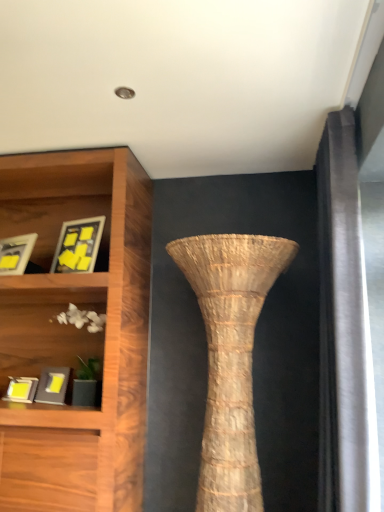
Question: Is the depth of natural woven vase at center greater than that of matte yellow picture frame at left, positioned as the 2th picture frame in top-to-bottom order?

Choices:
 (A) yes
 (B) no

Answer: (B)

Question: Is natural woven vase at center at the right side of matte yellow picture frame at left, which is the 3th picture frame from bottom to top?

Choices:
 (A) yes
 (B) no

Answer: (A)

Question: Does natural woven vase at center lie in front of matte yellow picture frame at left, which is the 3th picture frame from bottom to top?

Choices:
 (A) yes
 (B) no

Answer: (A)

Question: Can you confirm if natural woven vase at center is wider than matte yellow picture frame at left, which is the 3th picture frame from bottom to top?

Choices:
 (A) no
 (B) yes

Answer: (B)

Question: Is natural woven vase at center directly adjacent to matte yellow picture frame at left, which is the 3th picture frame from bottom to top?

Choices:
 (A) no
 (B) yes

Answer: (A)

Question: Considering their positions, is matte black picture frame at lower left, the 4th picture frame when ordered from top to bottom, located in front of or behind matte yellow picture frame at left, which is the 3th picture frame from bottom to top?

Choices:
 (A) front
 (B) behind

Answer: (B)

Question: Is matte black picture frame at lower left, the 1th picture frame from the bottom, inside the boundaries of matte yellow picture frame at left, which is the 3th picture frame from bottom to top, or outside?

Choices:
 (A) outside
 (B) inside

Answer: (A)

Question: Is matte black picture frame at lower left, the 4th picture frame when ordered from top to bottom, taller or shorter than matte yellow picture frame at left, which is the 3th picture frame from bottom to top?

Choices:
 (A) short
 (B) tall

Answer: (A)

Question: Based on their sizes in the image, would you say matte black picture frame at lower left, the 4th picture frame when ordered from top to bottom, is bigger or smaller than matte yellow picture frame at left, which is the 3th picture frame from bottom to top?

Choices:
 (A) big
 (B) small

Answer: (B)

Question: Considering the relative positions of white matte shells at lower left and matte black picture frame at lower left, the 4th picture frame when ordered from top to bottom, in the image provided, is white matte shells at lower left to the left or to the right of matte black picture frame at lower left, the 4th picture frame when ordered from top to bottom,?

Choices:
 (A) left
 (B) right

Answer: (B)

Question: Is point (3, 329) closer or farther from the camera than point (21, 392)?

Choices:
 (A) closer
 (B) farther

Answer: (B)

Question: From a real-world perspective, is white matte shells at lower left above or below matte black picture frame at lower left, the 1th picture frame from the bottom?

Choices:
 (A) above
 (B) below

Answer: (A)

Question: Considering the positions of white matte shells at lower left and matte black picture frame at lower left, the 4th picture frame when ordered from top to bottom, in the image, is white matte shells at lower left taller or shorter than matte black picture frame at lower left, the 4th picture frame when ordered from top to bottom,?

Choices:
 (A) tall
 (B) short

Answer: (A)

Question: Considering their positions, is matte black picture frame at lower left, the third picture frame viewed from the top, located in front of or behind matte yellow picture frame at left, positioned as the 2th picture frame in top-to-bottom order?

Choices:
 (A) behind
 (B) front

Answer: (B)

Question: From a real-world perspective, is matte black picture frame at lower left, the third picture frame viewed from the top, physically located above or below matte yellow picture frame at left, which is the 3th picture frame from bottom to top?

Choices:
 (A) above
 (B) below

Answer: (B)